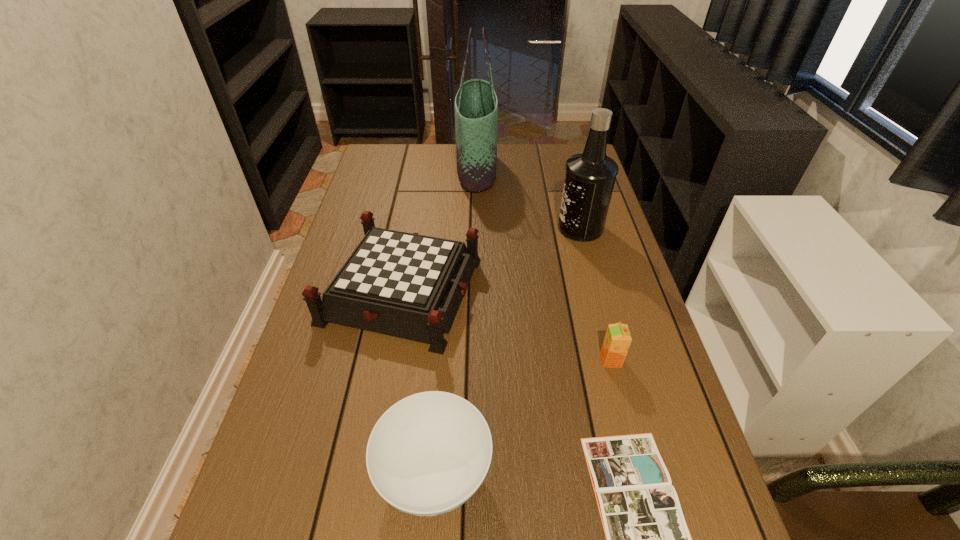
This screenshot has width=960, height=540. Identify the location of blank area at the far left corner. (373, 171).

This screenshot has width=960, height=540. What are the coordinates of `empty space that is in between the orange juice and the chinaware` in the screenshot? It's located at (522, 417).

The height and width of the screenshot is (540, 960). In order to click on free point between the orange juice and the checkerboard in this screenshot , I will do `click(506, 325)`.

This screenshot has width=960, height=540. Find the location of `free space between the tote bag and the second tallest object`. free space between the tote bag and the second tallest object is located at coordinates (528, 199).

Find the location of a particular element. The image size is (960, 540). free space between the chinaware and the farthest object is located at coordinates (455, 321).

I want to click on free space that is in between the chinaware and the orange juice, so click(x=522, y=417).

Where is `object that ranks as the fifth closest to the fifth shortest object`? This screenshot has height=540, width=960. object that ranks as the fifth closest to the fifth shortest object is located at coordinates (428, 454).

Select which object is the closest to the fifth shortest object. Please provide its 2D coordinates. Your answer should be formatted as a tuple, i.e. [(x, y)], where the tuple contains the x and y coordinates of a point satisfying the conditions above.

[(476, 105)]

Identify the location of free location that satisfies the following two spatial constraints: 1. on the front label of the second tallest object; 2. on the front side of the checkerboard. (597, 291).

The height and width of the screenshot is (540, 960). Identify the location of vacant space that satisfies the following two spatial constraints: 1. on the front side of the checkerboard; 2. on the right side of the orange juice. tap(390, 360).